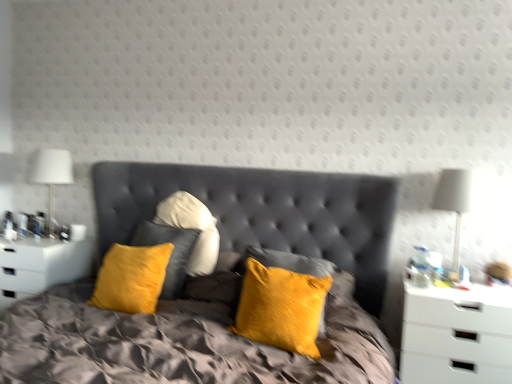
Where is `free space in front of white fabric lampshade at right, positioned as the first bedside lamp in front-to-back order`? Image resolution: width=512 pixels, height=384 pixels. free space in front of white fabric lampshade at right, positioned as the first bedside lamp in front-to-back order is located at coordinates (475, 293).